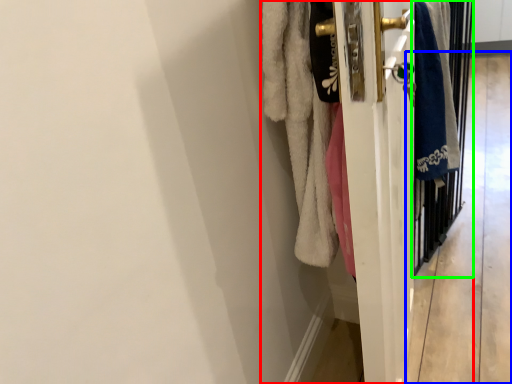
Question: Which object is the closest to the closet (highlighted by a red box)? Choose among these: corridor (highlighted by a blue box) or screen door (highlighted by a green box).

Choices:
 (A) corridor
 (B) screen door

Answer: (B)